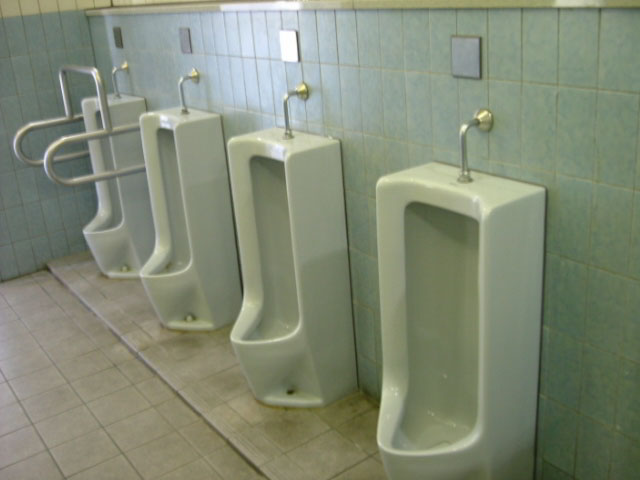
This screenshot has width=640, height=480. In order to click on urinals in this screenshot , I will do `click(123, 112)`, `click(182, 132)`, `click(276, 178)`, `click(434, 252)`.